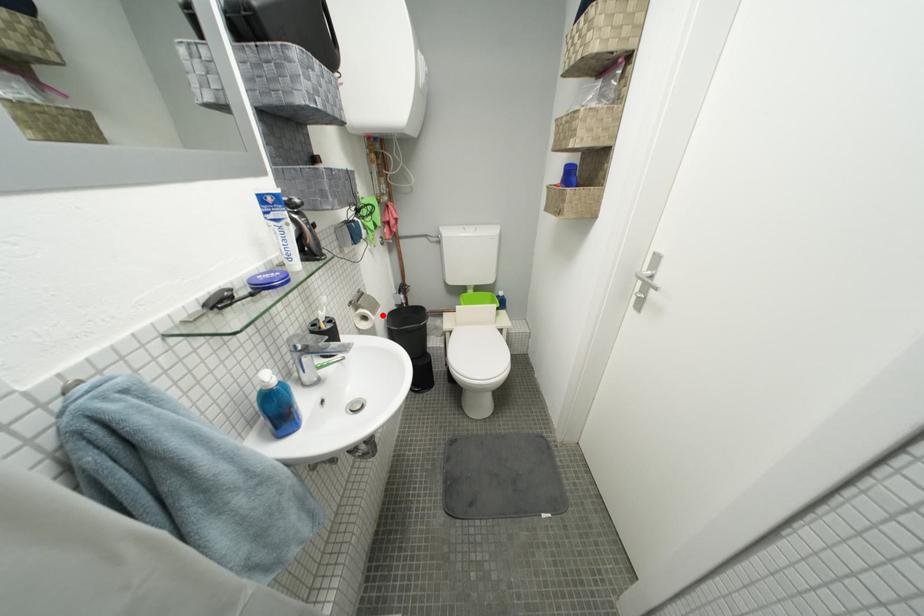
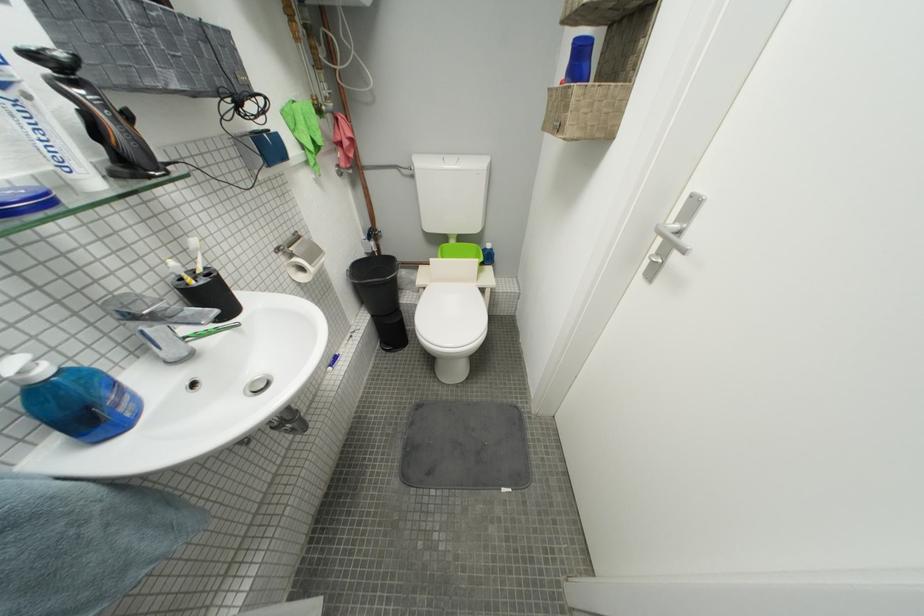
Where in the second image is the point corresponding to the highlighted location from the first image?

(320, 265)